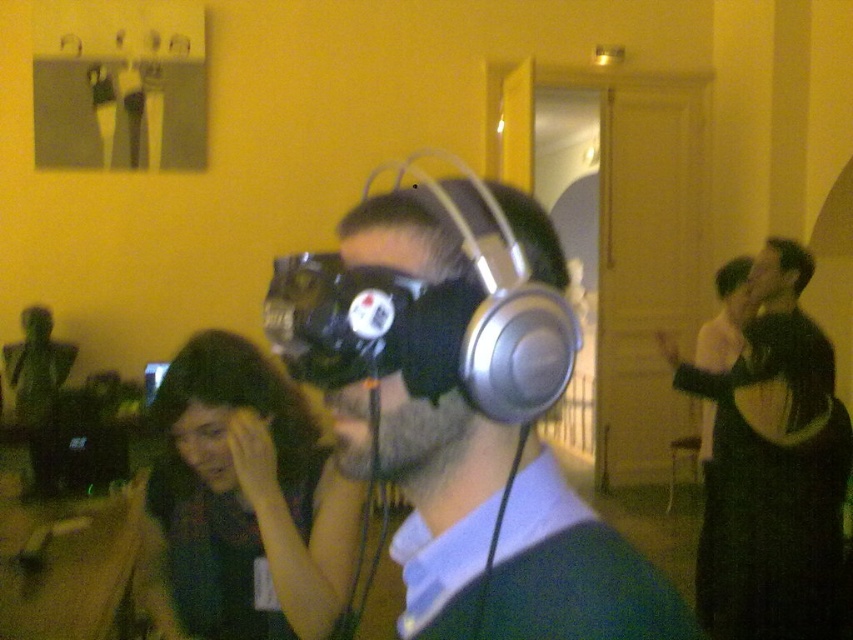
Question: Which point is farther from the camera taking this photo?

Choices:
 (A) (416, 540)
 (B) (750, 522)

Answer: (B)

Question: Does silver metallic headphones at center lie in front of black matte jacket at upper right?

Choices:
 (A) no
 (B) yes

Answer: (B)

Question: Does silver metallic headphones at center have a smaller size compared to black matte jacket at upper right?

Choices:
 (A) no
 (B) yes

Answer: (B)

Question: Which object appears closest to the camera in this image?

Choices:
 (A) black matte jacket at upper right
 (B) silver metallic headphones at center

Answer: (B)

Question: In this image, where is silver metallic headphones at center located relative to black matte jacket at upper right?

Choices:
 (A) left
 (B) right

Answer: (A)